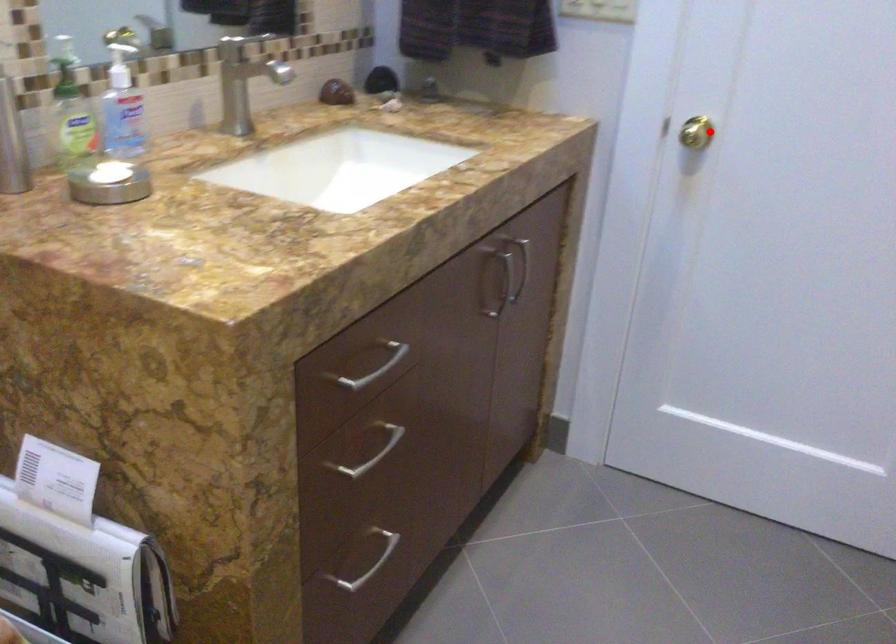
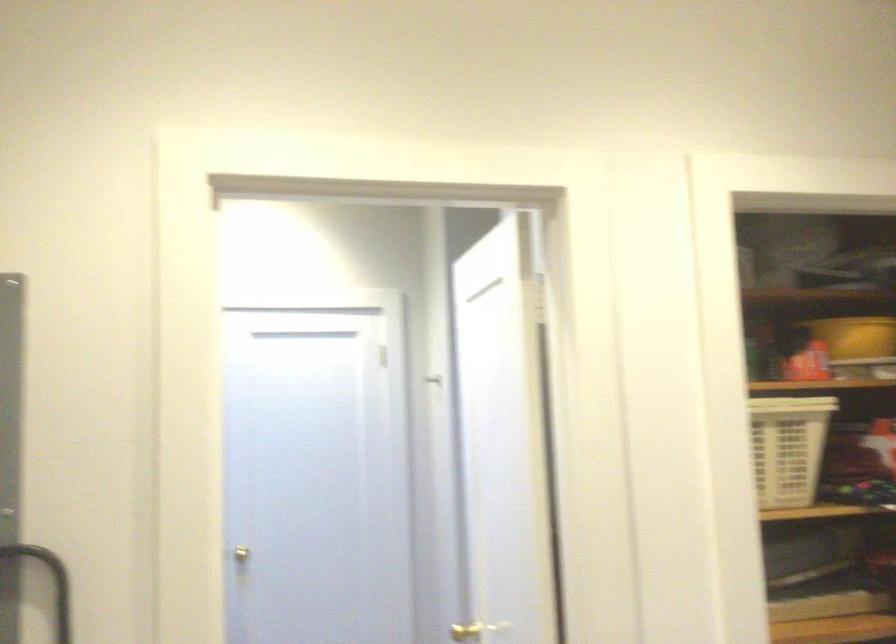
Where in the second image is the point corresponding to the highlighted location from the first image?

(253, 553)